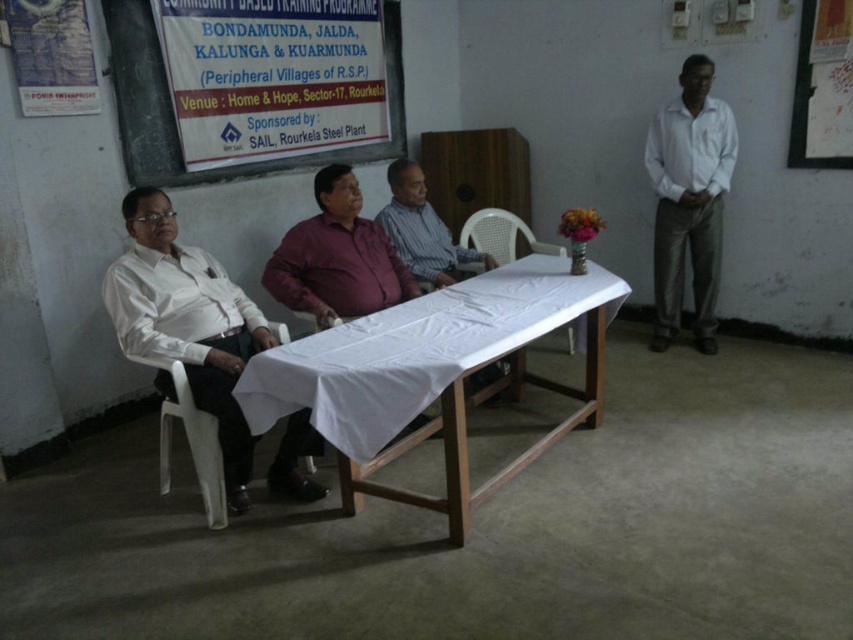
Question: Which object is positioned closest to the white paperboard at upper center?

Choices:
 (A) white smooth shirt at right
 (B) striped fabric shirt at center
 (C) white plastic chair at center

Answer: (B)

Question: Observing the image, what is the correct spatial positioning of white wooden table at center in reference to white paperboard at upper center?

Choices:
 (A) right
 (B) left

Answer: (A)

Question: Which point is closer to the camera?

Choices:
 (A) (154, 355)
 (B) (483, 356)

Answer: (B)

Question: Can you confirm if white glossy shirt at left is wider than white paperboard at upper center?

Choices:
 (A) no
 (B) yes

Answer: (A)

Question: Considering the real-world distances, which object is closest to the white plastic chair at center?

Choices:
 (A) striped fabric shirt at center
 (B) white glossy shirt at left
 (C) white wooden table at center

Answer: (A)

Question: Is white wooden table at center thinner than striped fabric shirt at center?

Choices:
 (A) no
 (B) yes

Answer: (A)